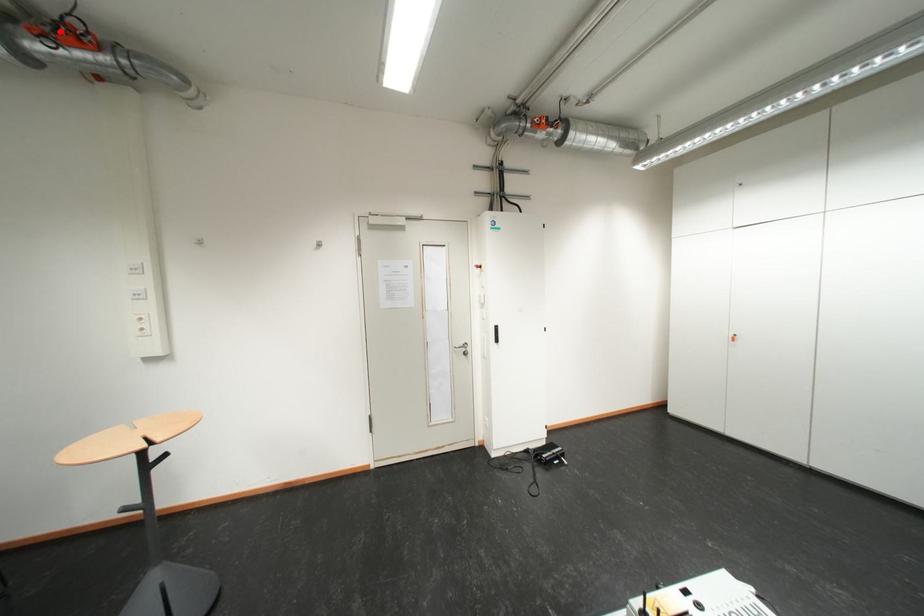
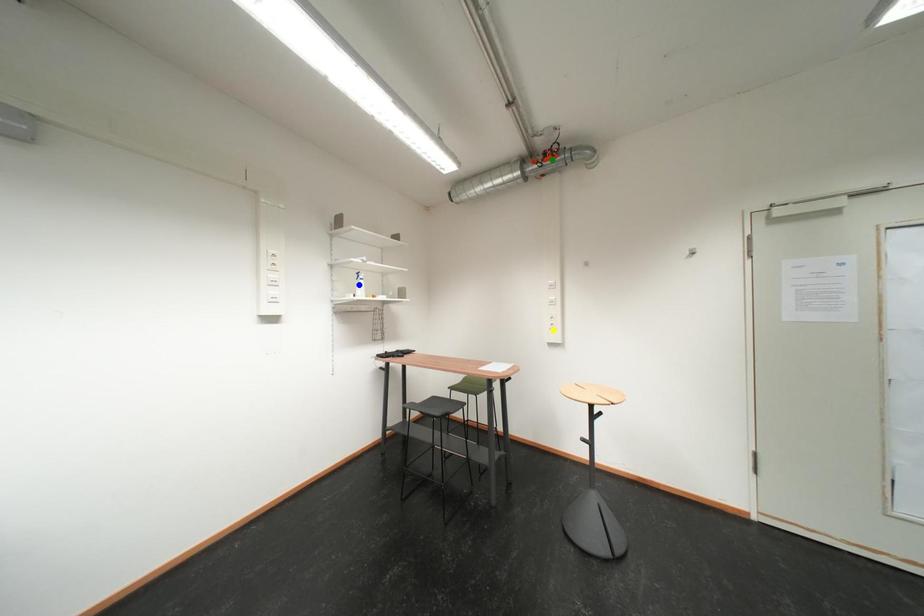
Question: I am providing you with two images of the same scene from different viewpoints. A red point is marked on the first image. You are given multiple points on the second image. Which spot in image 2 lines up with the point in image 1?

Choices:
 (A) green point
 (B) yellow point
 (C) blue point

Answer: (A)